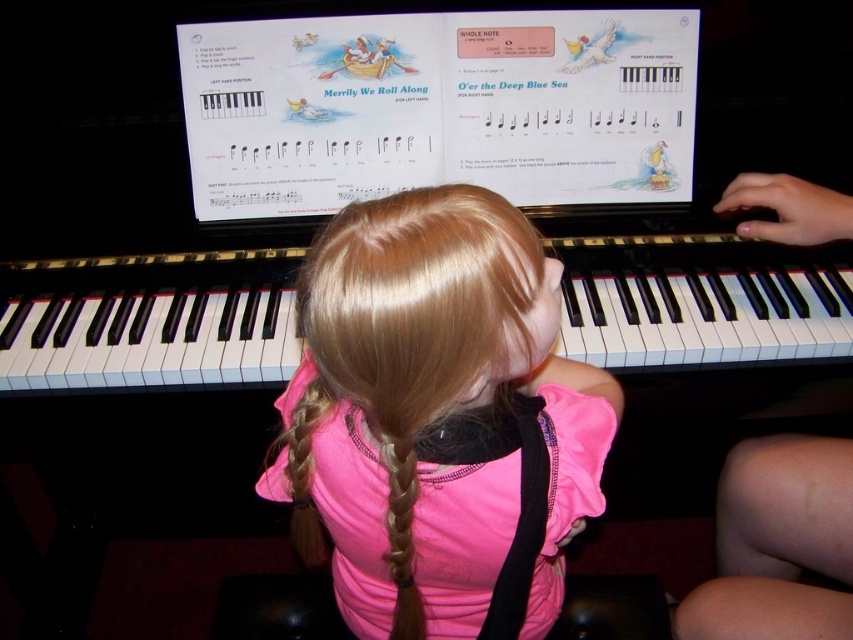
Does pink fabric shirt at center have a larger size compared to black polished piano at center?

Yes.

Is pink fabric shirt at center to the left of black polished piano at center from the viewer's perspective?

In fact, pink fabric shirt at center is to the right of black polished piano at center.

The image size is (853, 640). I want to click on pink fabric shirt at center, so (438, 419).

Does black polished piano at center have a smaller size compared to golden silky hair at center?

Incorrect, black polished piano at center is not smaller in size than golden silky hair at center.

Does point (738, 280) lie in front of point (408, 595)?

No, it is not.

Identify the location of black polished piano at center. Image resolution: width=853 pixels, height=640 pixels. (148, 321).

Does point (532, 369) lie in front of point (392, 472)?

No, it is behind (392, 472).

Can you confirm if pink fabric shirt at center is wider than golden silky hair at center?

Yes.

Which is in front, point (380, 589) or point (397, 624)?

Point (397, 624) is in front.

This screenshot has height=640, width=853. In order to click on pink fabric shirt at center in this screenshot , I will do `click(438, 419)`.